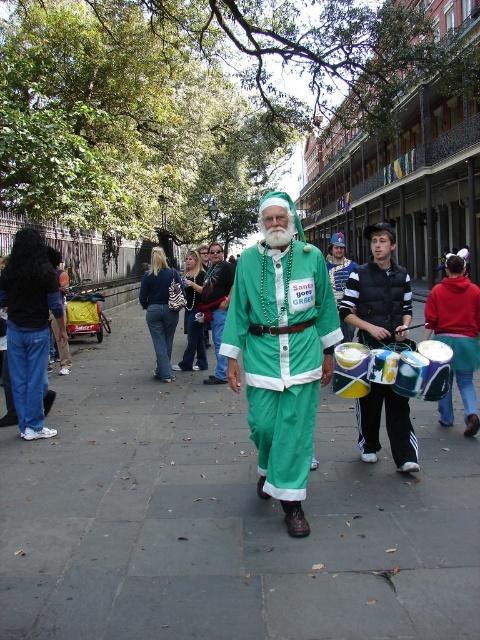
You are a photographer standing at the center of the street. You want to take a photo of the green fabric pants at center. Where should you aim your camera to capture the pants in the frame?

You should aim your camera at the point 0.812 on the x axis and 0.469 on the y axis to capture the green fabric pants at center.

Based on the photo, you are a photographer trying to capture the festive scene with both the green satin santa at center and the green matte santa suit at center in the frame. Which object should you focus on first to ensure both are in the shot?

The green satin santa at center is below the green matte santa suit at center, so you should focus on the green matte santa suit at center first to ensure both are in the frame.

Based on the photo, you are organizing a Christmas parade and need to decide which Santa costume to use. The green satin santa at center is available in a smaller size, while the green matte santa suit at center is larger. Which one would you choose if you want a costume that can be seen from a distance?

The green matte santa suit at center is larger in size, making it more visible from a distance compared to the smaller green satin santa at center. Therefore, the green matte santa suit at center would be the better choice for visibility during the parade.